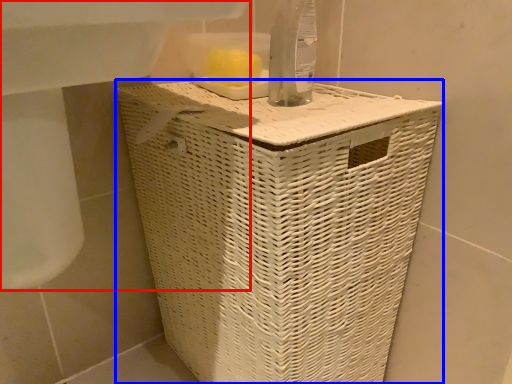
Question: Which of the following is the farthest to the observer, sink (highlighted by a red box) or waste container (highlighted by a blue box)?

Choices:
 (A) sink
 (B) waste container

Answer: (B)